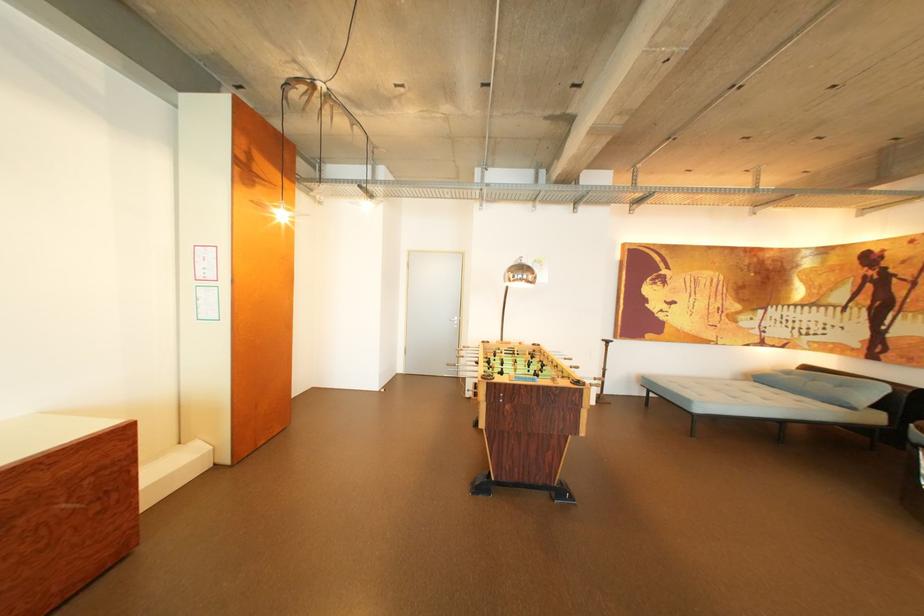
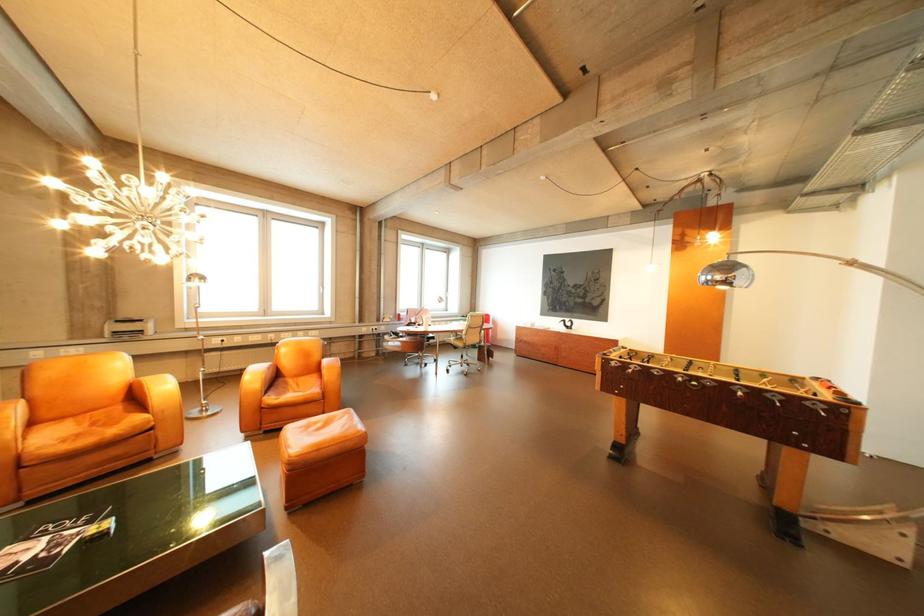
In the second image, find the point that corresponds to point (542, 278) in the first image.

(732, 278)